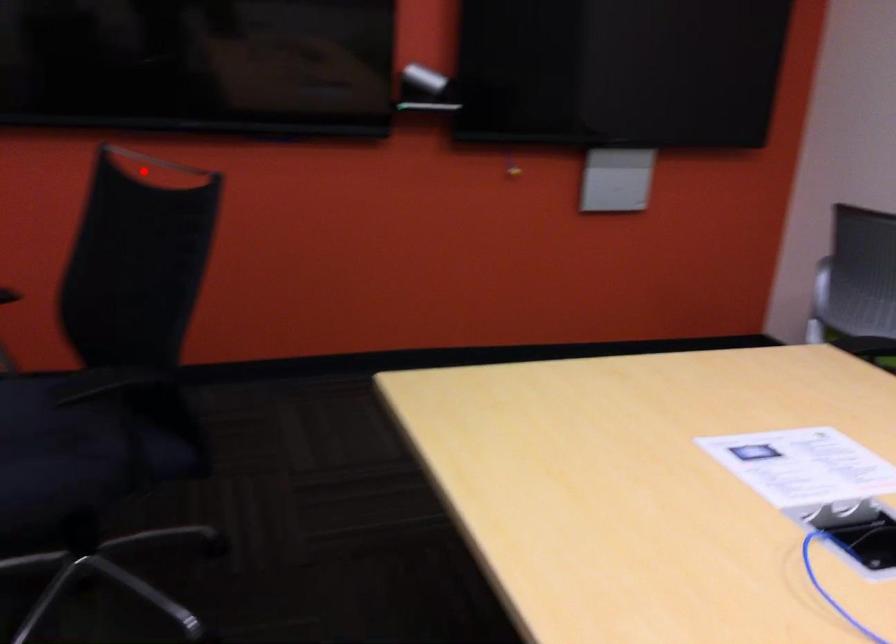
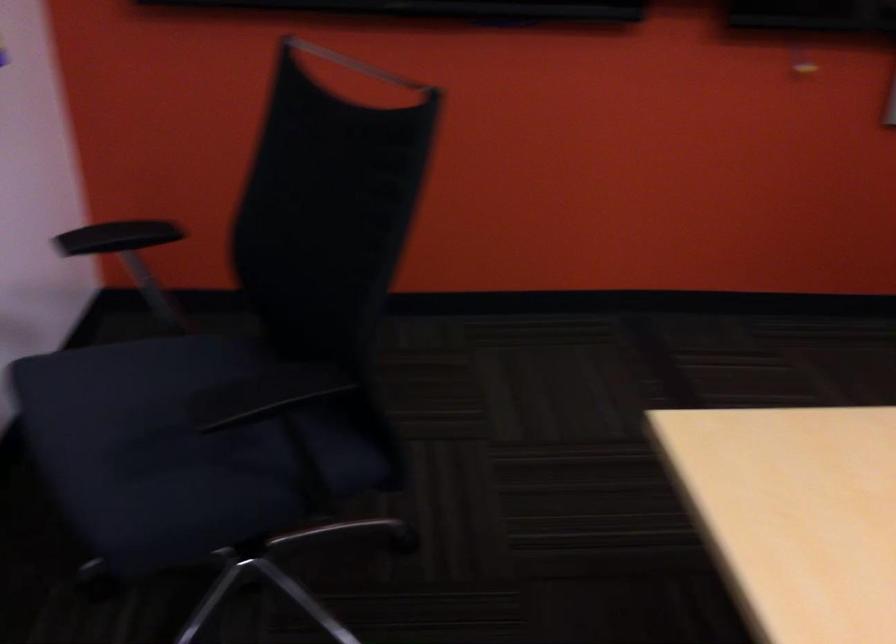
Locate, in the second image, the point that corresponds to the highlighted location in the first image.

(356, 64)